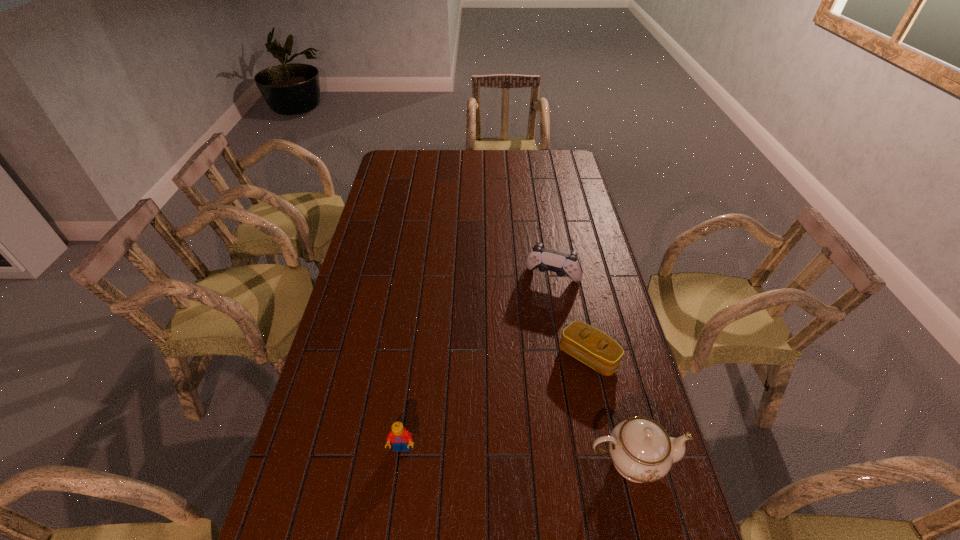
In the image, there is a desktop. Where is `vacant space at the far left corner`? Image resolution: width=960 pixels, height=540 pixels. vacant space at the far left corner is located at coordinates (417, 163).

This screenshot has width=960, height=540. I want to click on vacant space at the far right corner, so click(564, 162).

In the image, there is a desktop. Identify the location of vacant space at the near right corner. (659, 507).

Identify the location of vacant point located between the clutch bag and the control. (570, 317).

You are a GUI agent. You are given a task and a screenshot of the screen. Output one action in this format:
    pyautogui.click(x=<x>, y=<y>)
    Task: Click on the vacant space that is in between the chinaware and the second farthest object
    
    Given the screenshot: What is the action you would take?
    pyautogui.click(x=610, y=409)

Locate an element on the screen. The width and height of the screenshot is (960, 540). empty space that is in between the chinaware and the Lego is located at coordinates (516, 455).

The height and width of the screenshot is (540, 960). What are the coordinates of `free space between the shortest object and the control` in the screenshot? It's located at (570, 317).

Identify the location of vacant area between the leftmost object and the third nearest object. (495, 402).

You are a GUI agent. You are given a task and a screenshot of the screen. Output one action in this format:
    pyautogui.click(x=<x>, y=<y>)
    Task: Click on the vacant area between the clutch bag and the farthest object
    The image size is (960, 540).
    Given the screenshot: What is the action you would take?
    pyautogui.click(x=570, y=317)

Where is `free space between the third nearest object and the chinaware`? free space between the third nearest object and the chinaware is located at coordinates click(x=610, y=409).